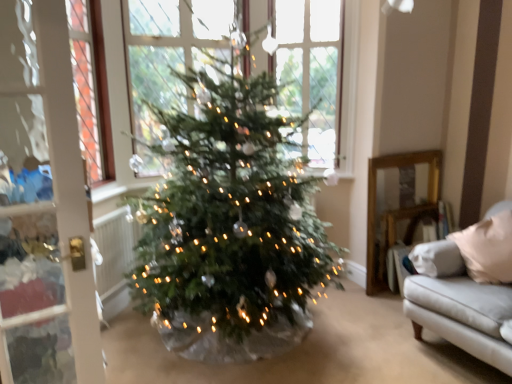
Describe the element at coordinates (398, 208) in the screenshot. The width and height of the screenshot is (512, 384). I see `white fabric couch at right` at that location.

Identify the location of white fabric couch at right. (398, 208).

This screenshot has height=384, width=512. What do you see at coordinates (310, 71) in the screenshot?
I see `clear glass window at upper center` at bounding box center [310, 71].

What is the approximate height of clear glass window at upper center?

The height of clear glass window at upper center is 1.38 meters.

This screenshot has width=512, height=384. I want to click on clear glass window at upper center, so click(x=310, y=71).

This screenshot has height=384, width=512. Find the location of `white fabric couch at right`. white fabric couch at right is located at coordinates (398, 208).

Looking at this image, which object is positioned more to the right, clear glass window at upper center or white fabric couch at right?

From the viewer's perspective, white fabric couch at right appears more on the right side.

Which is behind, clear glass window at upper center or white fabric couch at right?

white fabric couch at right is further away from the camera.

Which point is more distant from viewer, (335, 108) or (413, 177)?

Positioned behind is point (413, 177).

From the image's perspective, is clear glass window at upper center above white fabric couch at right?

Yes, from the image's perspective, clear glass window at upper center is over white fabric couch at right.

From a real-world perspective, is clear glass window at upper center above or below white fabric couch at right?

From a real-world perspective, clear glass window at upper center is physically above white fabric couch at right.

Can you confirm if clear glass window at upper center is thinner than white fabric couch at right?

No, clear glass window at upper center is not thinner than white fabric couch at right.

Who is shorter, clear glass window at upper center or white fabric couch at right?

Standing shorter between the two is white fabric couch at right.

Does clear glass window at upper center have a larger size compared to white fabric couch at right?

Yes, clear glass window at upper center is bigger than white fabric couch at right.

Is white fabric couch at right inside clear glass window at upper center?

Actually, white fabric couch at right is outside clear glass window at upper center.

Is clear glass window at upper center in contact with white fabric couch at right?

No, clear glass window at upper center is not with white fabric couch at right.

From the picture: Does clear glass window at upper center turn towards white fabric couch at right?

No.

What's the angular difference between clear glass window at upper center and white fabric couch at right's facing directions?

45.5 degrees.

At what (x,y) coordinates should I click in order to perform the action: click on furniture that is behind the clear glass window at upper center. Please return your answer as a coordinate pair (x, y). The width and height of the screenshot is (512, 384). Looking at the image, I should click on (398, 208).

Which is more to the right, white fabric couch at right or clear glass window at upper center?

white fabric couch at right.

Which is behind, white fabric couch at right or clear glass window at upper center?

white fabric couch at right.

Is point (434, 154) less distant than point (312, 83)?

No.

From the image's perspective, which one is positioned lower, white fabric couch at right or clear glass window at upper center?

white fabric couch at right.

From a real-world perspective, is white fabric couch at right physically located above or below clear glass window at upper center?

In terms of real-world spatial position, white fabric couch at right is below clear glass window at upper center.

Is white fabric couch at right wider than clear glass window at upper center?

Incorrect, the width of white fabric couch at right does not surpass that of clear glass window at upper center.

Which of these two, white fabric couch at right or clear glass window at upper center, stands taller?

clear glass window at upper center is taller.

Is white fabric couch at right bigger than clear glass window at upper center?

Actually, white fabric couch at right might be smaller than clear glass window at upper center.

Is clear glass window at upper center inside white fabric couch at right?

Definitely not — clear glass window at upper center is not inside white fabric couch at right.

Is white fabric couch at right positioned far away from clear glass window at upper center?

No, white fabric couch at right is not far away from clear glass window at upper center.

Looking at this image, is white fabric couch at right facing towards clear glass window at upper center?

No, white fabric couch at right is not facing towards clear glass window at upper center.

Can you tell me how much white fabric couch at right and clear glass window at upper center differ in facing direction?

The angle between the facing direction of white fabric couch at right and the facing direction of clear glass window at upper center is 45.5 degrees.

Identify the location of window above the white fabric couch at right (from a real-world perspective). The image size is (512, 384). (310, 71).

In order to click on window above the white fabric couch at right (from a real-world perspective) in this screenshot , I will do `click(310, 71)`.

This screenshot has height=384, width=512. Identify the location of furniture behind the clear glass window at upper center. (398, 208).